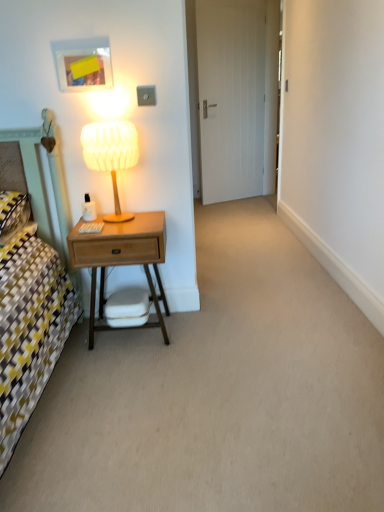
Locate an element on the screen. The width and height of the screenshot is (384, 512). white matte door at center is located at coordinates (233, 96).

From the image's perspective, does white matte swivel chair at center appear lower than white matte door at center?

Yes.

Is white matte swivel chair at center in front of white matte door at center?

Yes, it is.

From a real-world perspective, is white matte swivel chair at center located beneath white matte door at center?

Yes, from a real-world perspective, white matte swivel chair at center is below white matte door at center.

Considering the relative sizes of white matte swivel chair at center and white matte door at center in the image provided, is white matte swivel chair at center thinner than white matte door at center?

In fact, white matte swivel chair at center might be wider than white matte door at center.

In the scene shown: Is white matte door at center facing towards wooden table lamp at left?

No, white matte door at center does not turn towards wooden table lamp at left.

At what (x,y) coordinates should I click in order to perform the action: click on table lamp on the left of the white matte door at center. Please return your answer as a coordinate pair (x, y). This screenshot has height=512, width=384. Looking at the image, I should click on (111, 155).

Is white matte door at center positioned beyond the bounds of wooden table lamp at left?

Yes, white matte door at center is outside of wooden table lamp at left.

Between white matte door at center and wooden table lamp at left, which one appears on the right side from the viewer's perspective?

white matte door at center is more to the right.

Based on the photo, is white matte swivel chair at center completely or partially inside wooden nightstand at left?

That's correct, white matte swivel chair at center is inside wooden nightstand at left.

Considering the relative sizes of wooden nightstand at left and white matte swivel chair at center in the image provided, is wooden nightstand at left thinner than white matte swivel chair at center?

No, wooden nightstand at left is not thinner than white matte swivel chair at center.

Is wooden nightstand at left looking in the opposite direction of white matte swivel chair at center?

Absolutely, wooden nightstand at left is directed away from white matte swivel chair at center.

Is wooden nightstand at left not close to white matte swivel chair at center?

No, wooden nightstand at left is not far from white matte swivel chair at center.

Could wooden table lamp at left be considered to be inside wooden nightstand at left?

No, wooden nightstand at left does not contain wooden table lamp at left.

Is wooden nightstand at left oriented towards wooden table lamp at left?

No, wooden nightstand at left is not facing towards wooden table lamp at left.

Between point (145, 271) and point (109, 129), which one is positioned in front?

The point (109, 129) is closer.

Can you confirm if white matte swivel chair at center is smaller than wooden nightstand at left?

Yes.

From the image's perspective, who appears lower, white matte swivel chair at center or wooden nightstand at left?

white matte swivel chair at center, from the image's perspective.

Which object is positioned more to the left, white matte swivel chair at center or wooden nightstand at left?

wooden nightstand at left is more to the left.

Which object is wider, white matte swivel chair at center or wooden nightstand at left?

wooden nightstand at left is wider.

Which object is closer to the camera taking this photo, white matte door at center or white matte swivel chair at center?

white matte swivel chair at center is in front.

Does point (245, 165) come farther from viewer compared to point (113, 317)?

Yes, point (245, 165) is behind point (113, 317).

Would you consider white matte door at center to be distant from white matte swivel chair at center?

white matte door at center is positioned a significant distance from white matte swivel chair at center.

Consider the image. From the image's perspective, between wooden table lamp at left and wooden nightstand at left, who is located below?

wooden nightstand at left is shown below in the image.

Locate an element on the screen. This screenshot has height=512, width=384. nightstand below the wooden table lamp at left (from a real-world perspective) is located at coordinates (122, 259).

How much distance is there between wooden table lamp at left and wooden nightstand at left?

The distance of wooden table lamp at left from wooden nightstand at left is 10.93 inches.

Can you confirm if wooden table lamp at left is taller than wooden nightstand at left?

No, wooden table lamp at left is not taller than wooden nightstand at left.

The image size is (384, 512). I want to click on door that appears above the white matte swivel chair at center (from the image's perspective), so click(x=233, y=96).

Find the location of a particular element. This screenshot has height=512, width=384. door behind the wooden table lamp at left is located at coordinates (233, 96).

Looking at the image, which one is located further to wooden table lamp at left, white matte swivel chair at center or wooden nightstand at left?

The object further to wooden table lamp at left is white matte swivel chair at center.

Estimate the real-world distances between objects in this image. Which object is closer to white matte door at center, white matte swivel chair at center or wooden table lamp at left?

wooden table lamp at left is positioned closer to the anchor white matte door at center.

Considering their positions, is wooden nightstand at left positioned closer to white matte door at center than white matte swivel chair at center?

wooden nightstand at left.

Estimate the real-world distances between objects in this image. Which object is closer to white matte door at center, wooden nightstand at left or wooden table lamp at left?

wooden table lamp at left.

Based on their spatial positions, is white matte swivel chair at center or white matte door at center closer to wooden nightstand at left?

white matte swivel chair at center is closer to wooden nightstand at left.

Looking at the image, which one is located closer to wooden nightstand at left, wooden table lamp at left or white matte door at center?

Based on the image, wooden table lamp at left appears to be nearer to wooden nightstand at left.

Estimate the real-world distances between objects in this image. Which object is closer to wooden nightstand at left, white matte swivel chair at center or wooden table lamp at left?

white matte swivel chair at center is closer to wooden nightstand at left.

Based on their spatial positions, is wooden nightstand at left or wooden table lamp at left closer to white matte swivel chair at center?

wooden nightstand at left.

This screenshot has width=384, height=512. Find the location of `nightstand positioned between wooden table lamp at left and white matte door at center from near to far`. nightstand positioned between wooden table lamp at left and white matte door at center from near to far is located at coordinates (122, 259).

Find the location of `swivel chair between wooden nightstand at left and white matte door at center in the front-back direction`. swivel chair between wooden nightstand at left and white matte door at center in the front-back direction is located at coordinates (127, 308).

I want to click on swivel chair between wooden table lamp at left and white matte door at center in the front-back direction, so click(x=127, y=308).

In order to click on nightstand between wooden table lamp at left and white matte swivel chair at center in the up-down direction in this screenshot , I will do `click(122, 259)`.